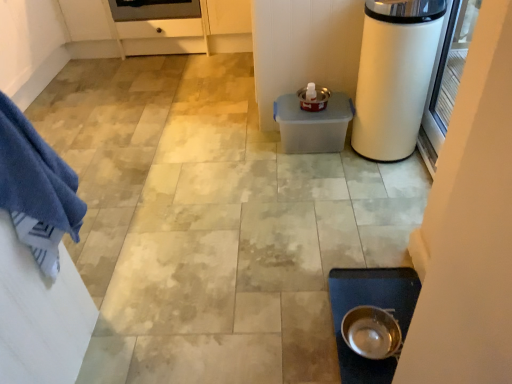
Image resolution: width=512 pixels, height=384 pixels. I want to click on vacant space behind metallic silver bowl at lower center, so click(x=368, y=285).